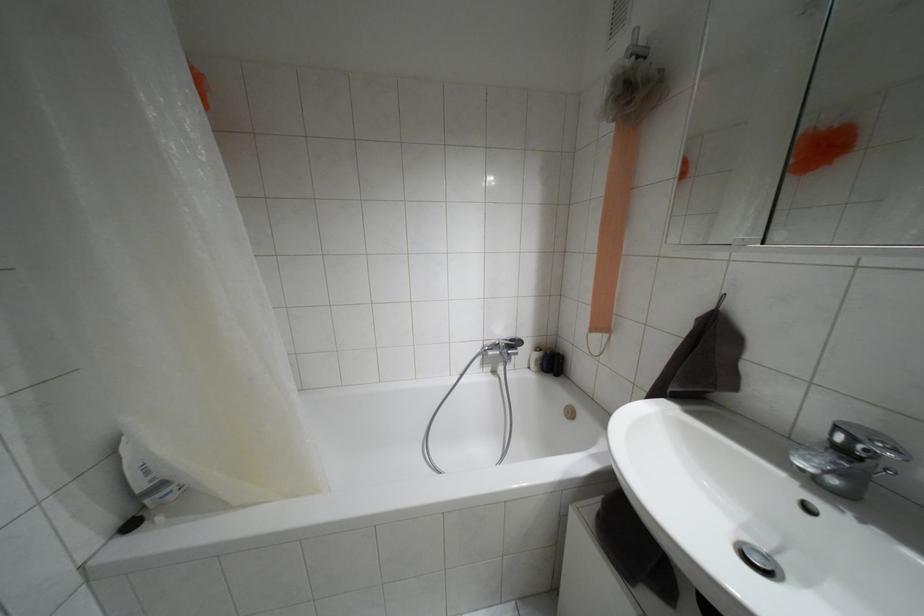
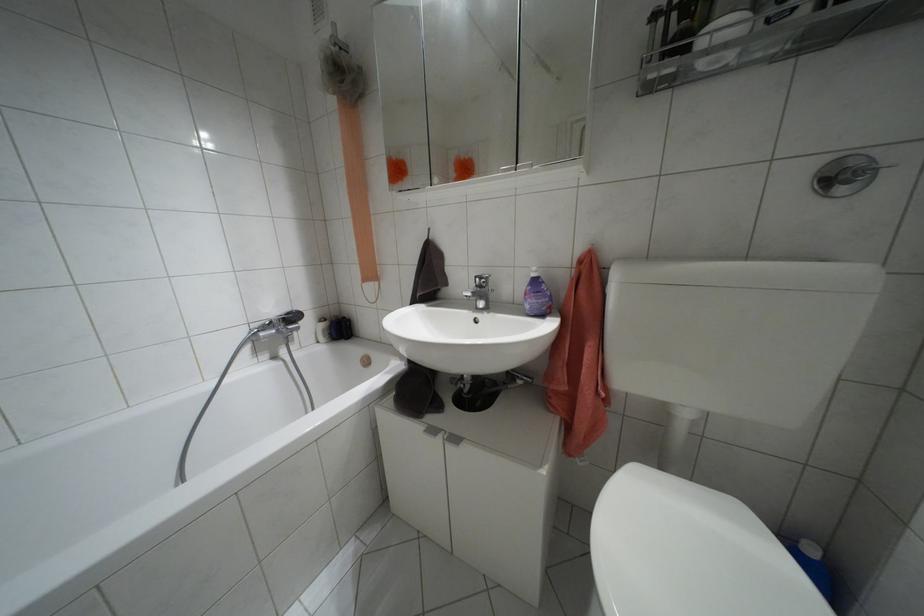
Where in the second image is the point corresponding to point (511, 339) from the first image?

(286, 313)